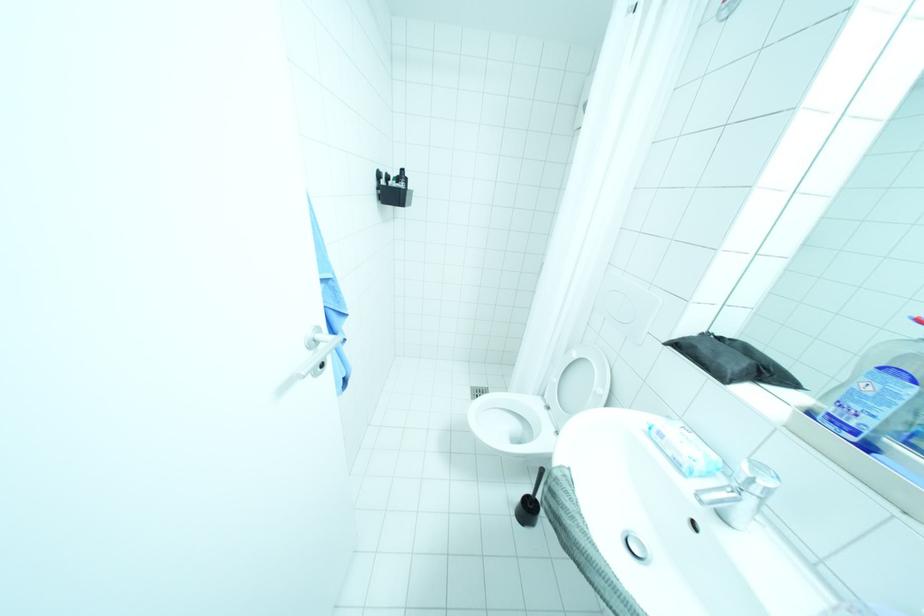
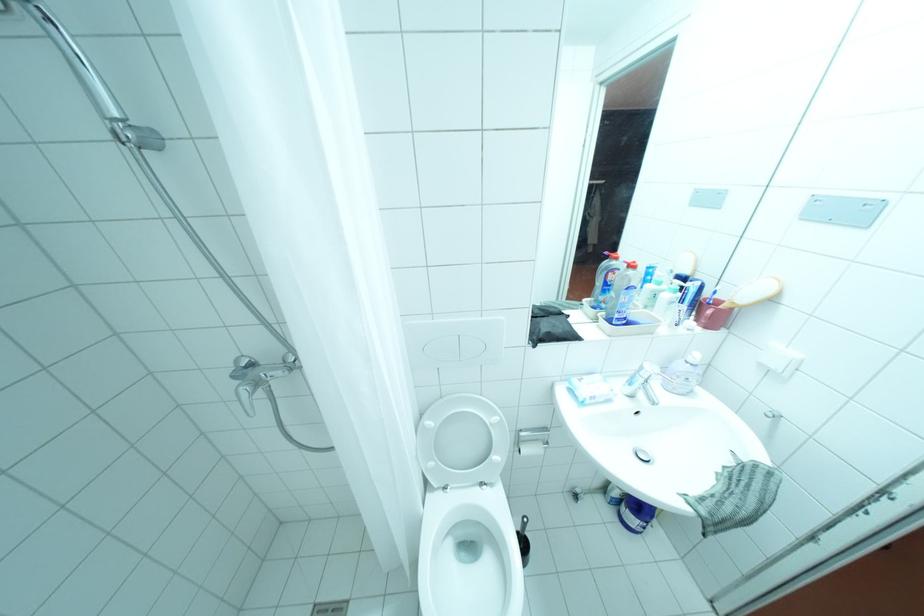
Find the pixel in the second image that matches pixel 556 407 in the first image.

(455, 487)